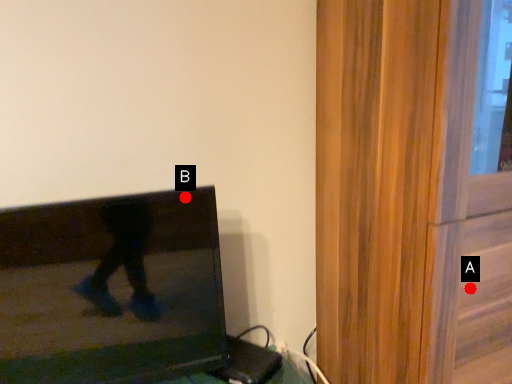
Question: Two points are circled on the image, labeled by A and B beside each circle. Which point is further to the camera?

Choices:
 (A) A is further
 (B) B is further

Answer: (B)